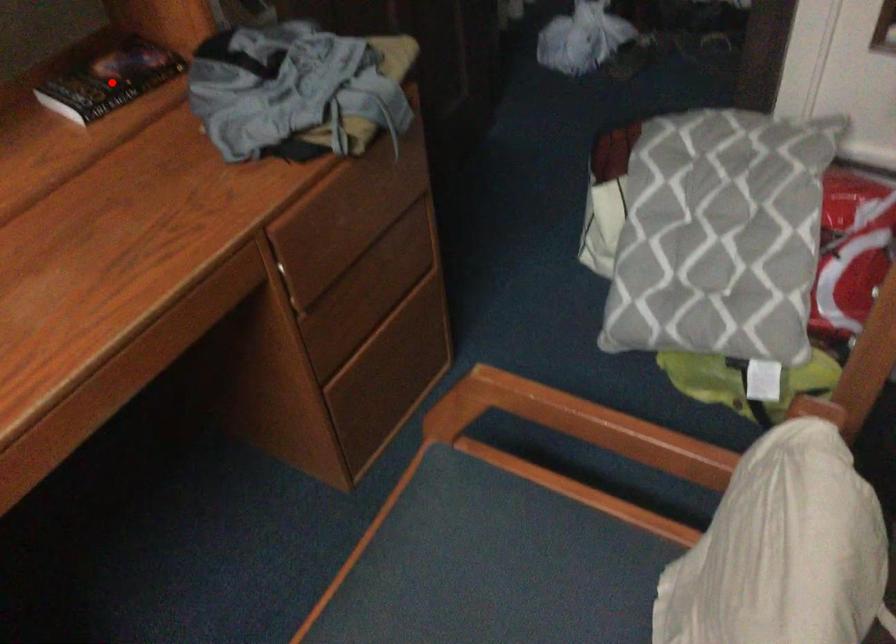
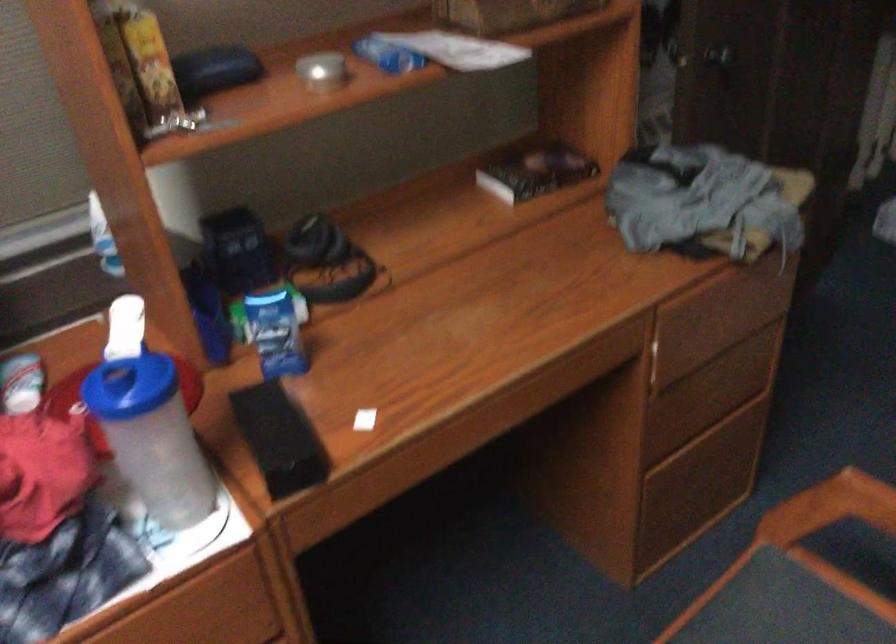
Question: I am providing you with two images of the same scene from different viewpoints. Given a red point in image1, look at the same physical point in image2. Is it:

Choices:
 (A) Closer to the viewpoint
 (B) Farther from the viewpoint

Answer: (B)